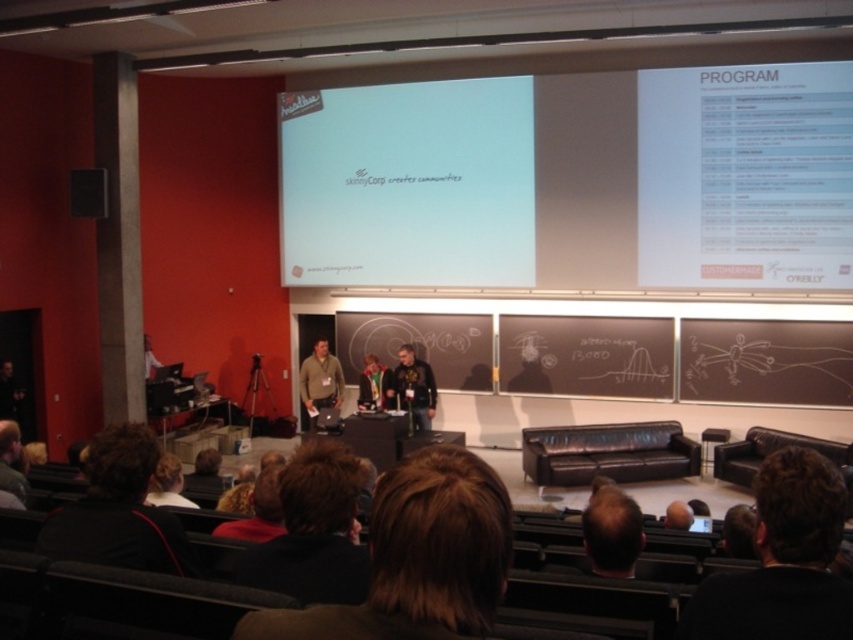
Question: Is brown hair at lower right bigger than matte gold medal at center?

Choices:
 (A) yes
 (B) no

Answer: (B)

Question: Is brown hair at center positioned behind brown leather jacket at lower left?

Choices:
 (A) no
 (B) yes

Answer: (A)

Question: Can you confirm if brown hair at lower center is wider than black leather jacket at center?

Choices:
 (A) yes
 (B) no

Answer: (B)

Question: Estimate the real-world distances between objects in this image. Which object is closer to the black leather jacket at center?

Choices:
 (A) brown hair at upper center
 (B) matte black speaker at left

Answer: (B)

Question: Among these objects, which one is nearest to the camera?

Choices:
 (A) black leather jacket at center
 (B) white paper at upper center
 (C) light brown hair at center

Answer: (C)

Question: Which object is positioned farthest from the brown hair at center?

Choices:
 (A) white paper at upper center
 (B) matte black speaker at left
 (C) brown hair at lower right

Answer: (A)